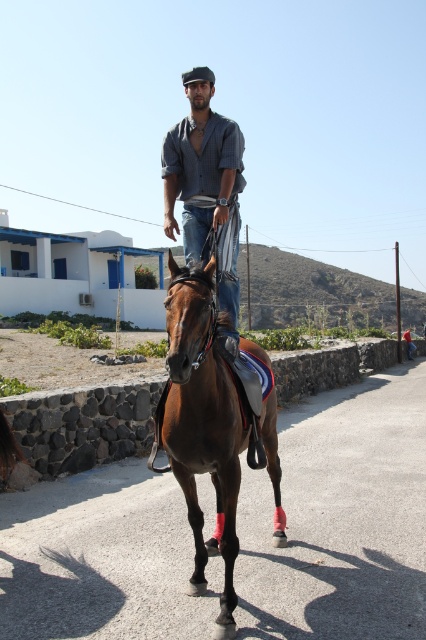
Question: Among these points, which one is nearest to the camera?

Choices:
 (A) (173, 189)
 (B) (178, 305)

Answer: (B)

Question: Which of the following is the farthest from the observer?

Choices:
 (A) (198, 184)
 (B) (218, 637)

Answer: (A)

Question: Which object is farther from the camera taking this photo?

Choices:
 (A) matte blue shirt at center
 (B) glossy brown horse at center

Answer: (A)

Question: Does glossy brown horse at center appear under matte blue shirt at center?

Choices:
 (A) no
 (B) yes

Answer: (B)

Question: Does glossy brown horse at center appear on the left side of matte blue shirt at center?

Choices:
 (A) no
 (B) yes

Answer: (A)

Question: Does glossy brown horse at center lie in front of matte blue shirt at center?

Choices:
 (A) no
 (B) yes

Answer: (B)